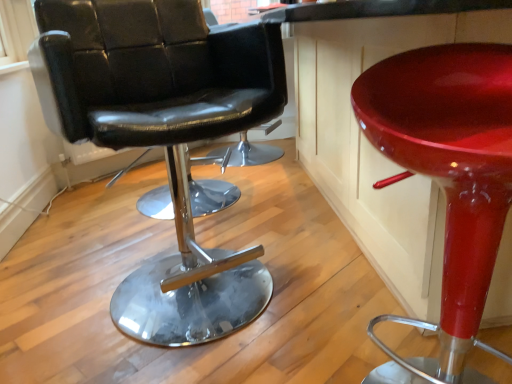
The width and height of the screenshot is (512, 384). Describe the element at coordinates (447, 181) in the screenshot. I see `glossy red stool at right` at that location.

The image size is (512, 384). What are the coordinates of `glossy red stool at right` in the screenshot? It's located at (447, 181).

Find the location of `black leather chair at left`. black leather chair at left is located at coordinates (164, 137).

Describe the element at coordinates (164, 137) in the screenshot. I see `black leather chair at left` at that location.

The height and width of the screenshot is (384, 512). In order to click on glossy red stool at right in this screenshot , I will do `click(447, 181)`.

In the scene shown: Considering the positions of objects glossy red stool at right and black leather chair at left in the image provided, who is more to the right, glossy red stool at right or black leather chair at left?

glossy red stool at right is more to the right.

Who is more distant, glossy red stool at right or black leather chair at left?

black leather chair at left.

Which is in front, point (439, 135) or point (221, 127)?

The point (439, 135) is closer.

From the image's perspective, is glossy red stool at right under black leather chair at left?

Indeed, from the image's perspective, glossy red stool at right is shown beneath black leather chair at left.

Looking at this image, from a real-world perspective, is glossy red stool at right under black leather chair at left?

Yes, from a real-world perspective, glossy red stool at right is below black leather chair at left.

Considering the sizes of objects glossy red stool at right and black leather chair at left in the image provided, who is thinner, glossy red stool at right or black leather chair at left?

glossy red stool at right is thinner.

From their relative heights in the image, would you say glossy red stool at right is taller or shorter than black leather chair at left?

Considering their sizes, glossy red stool at right has less height than black leather chair at left.

Considering the relative sizes of glossy red stool at right and black leather chair at left in the image provided, is glossy red stool at right bigger than black leather chair at left?

No.

Is glossy red stool at right inside or outside of black leather chair at left?

glossy red stool at right is spatially situated outside black leather chair at left.

From the picture: Is glossy red stool at right not close to black leather chair at left?

No, glossy red stool at right is in close proximity to black leather chair at left.

Does glossy red stool at right turn towards black leather chair at left?

No, glossy red stool at right is not turned towards black leather chair at left.

How many degrees apart are the facing directions of glossy red stool at right and black leather chair at left?

They differ by 23.3 degrees in their facing directions.

Locate an element on the screen. The height and width of the screenshot is (384, 512). chair above the glossy red stool at right (from a real-world perspective) is located at coordinates (164, 137).

Is black leather chair at left to the right of glossy red stool at right from the viewer's perspective?

No, black leather chair at left is not to the right of glossy red stool at right.

Is black leather chair at left positioned before glossy red stool at right?

No.

Does point (264, 87) come closer to viewer compared to point (465, 111)?

No, (264, 87) is behind (465, 111).

From the image's perspective, would you say black leather chair at left is shown under glossy red stool at right?

No, from the image's perspective, black leather chair at left is not below glossy red stool at right.

From a real-world perspective, is black leather chair at left on top of glossy red stool at right?

Yes, from a real-world perspective, black leather chair at left is on top of glossy red stool at right.

Considering the relative sizes of black leather chair at left and glossy red stool at right in the image provided, is black leather chair at left wider than glossy red stool at right?

Yes, black leather chair at left is wider than glossy red stool at right.

Between black leather chair at left and glossy red stool at right, which one has less height?

glossy red stool at right is shorter.

In terms of size, does black leather chair at left appear bigger or smaller than glossy red stool at right?

In the image, black leather chair at left appears to be larger than glossy red stool at right.

Consider the image. Can we say black leather chair at left lies outside glossy red stool at right?

Yes.

Is black leather chair at left far away from glossy red stool at right?

That's not correct — black leather chair at left is a little close to glossy red stool at right.

Is black leather chair at left positioned with its back to glossy red stool at right?

No, glossy red stool at right is not at the back of black leather chair at left.

The image size is (512, 384). Identify the location of stool located below the black leather chair at left (from the image's perspective). (447, 181).

The height and width of the screenshot is (384, 512). In the image, there is a black leather chair at left. In order to click on stool below it (from the image's perspective) in this screenshot , I will do `click(447, 181)`.

At what (x,y) coordinates should I click in order to perform the action: click on chair lying behind the glossy red stool at right. Please return your answer as a coordinate pair (x, y). The height and width of the screenshot is (384, 512). Looking at the image, I should click on (164, 137).